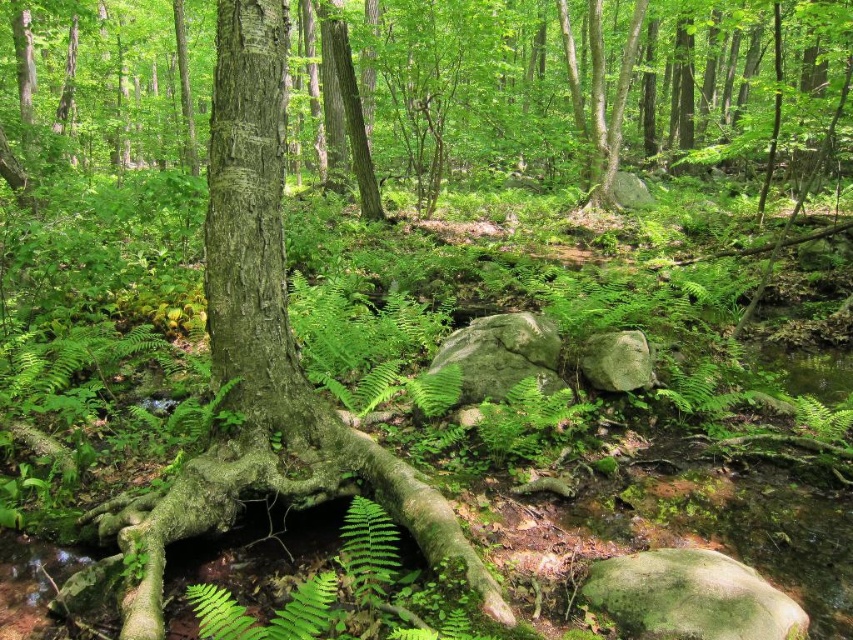
Question: Which object appears farthest from the camera in this image?

Choices:
 (A) green mossy rock at center
 (B) gray rough rock at center

Answer: (B)

Question: Can you confirm if green mossy rock at center is positioned above gray rough rock at center?

Choices:
 (A) yes
 (B) no

Answer: (A)

Question: Can you confirm if green mossy rock at center is smaller than gray rough rock at center?

Choices:
 (A) yes
 (B) no

Answer: (B)

Question: Among these objects, which one is farthest from the camera?

Choices:
 (A) gray rough rock at center
 (B) green mossy rock at center

Answer: (A)

Question: Is green mossy rock at center positioned behind gray rough rock at center?

Choices:
 (A) yes
 (B) no

Answer: (B)

Question: Which point appears closest to the camera in this image?

Choices:
 (A) (625, 356)
 (B) (534, 340)

Answer: (A)